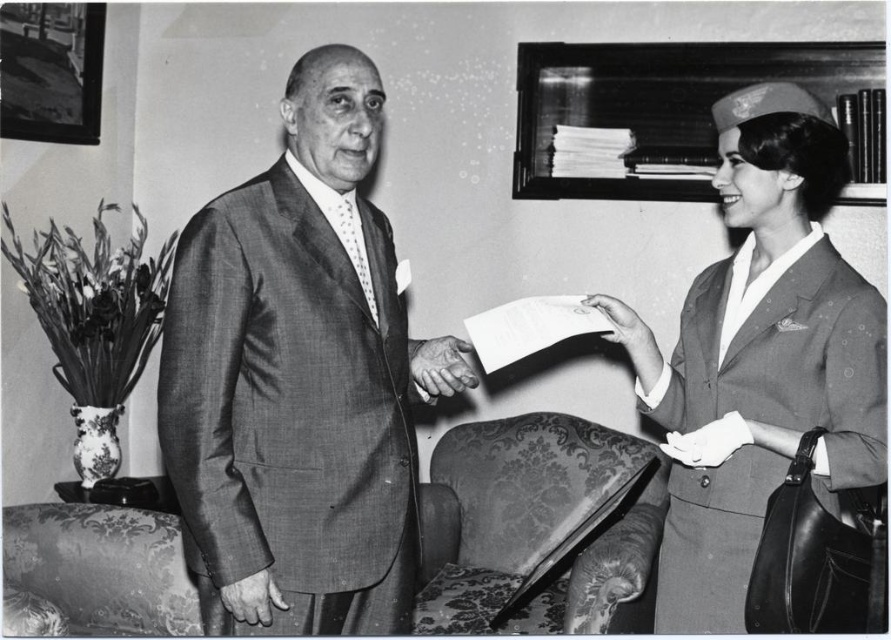
You are a photographer who needs to position a light source to highlight both the smooth fabric uniform at right and the smooth skin hand at lower left. Based on their positions, which object should be placed closer to the light source to ensure both are equally illuminated?

The smooth fabric uniform at right should be placed closer to the light source because it is positioned to the right of the smooth skin hand at lower left, so adjusting their distance from the light can balance their illumination.

You are standing in the office and need to locate the smooth fabric uniform at right. According to the image, where exactly is it located?

The smooth fabric uniform at right is located at point 0.555 on the x axis and 0.855 on the y axis.

You are an interior designer analyzing the office layout. The point of interest at coordinates point (x=295, y=376) is where the smooth wool suit at center is located. Can you determine if this point is closer to the man on the left or the woman on the right?

The point (x=295, y=376) is where the smooth wool suit at center is located, so it is equidistant between the man on the left and the woman on the right.